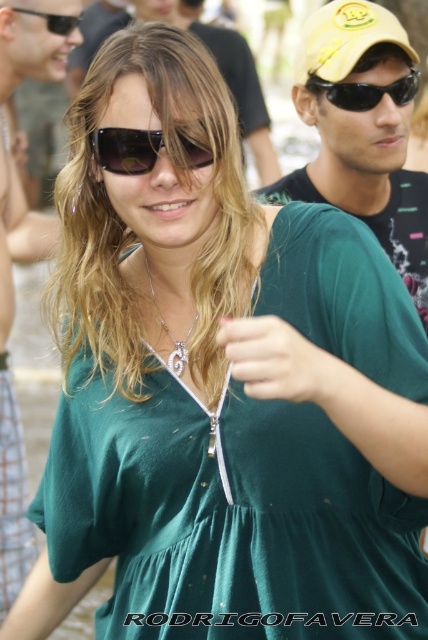
Question: Which object is the closest to the matte black sunglasses at upper left?

Choices:
 (A) silver/golden metallic pendant at center
 (B) matte yellow cap at upper right
 (C) black plastic sunglasses at upper left

Answer: (C)

Question: Which point is closer to the camera?

Choices:
 (A) yellow fabric baseball cap at upper right
 (B) black plastic sunglasses at upper right

Answer: (A)

Question: Is black plastic sunglasses at upper right below silver/golden metallic pendant at center?

Choices:
 (A) yes
 (B) no

Answer: (B)

Question: Does matte yellow cap at upper right appear under black plastic sunglasses at upper right?

Choices:
 (A) yes
 (B) no

Answer: (A)

Question: Which object is positioned closest to the black plastic sunglasses at upper right?

Choices:
 (A) matte black sunglasses at upper left
 (B) matte black sunglasses at upper center
 (C) matte yellow cap at upper right
 (D) silver/golden metallic pendant at center

Answer: (C)

Question: Is matte black sunglasses at upper left below yellow fabric baseball cap at upper right?

Choices:
 (A) yes
 (B) no

Answer: (B)